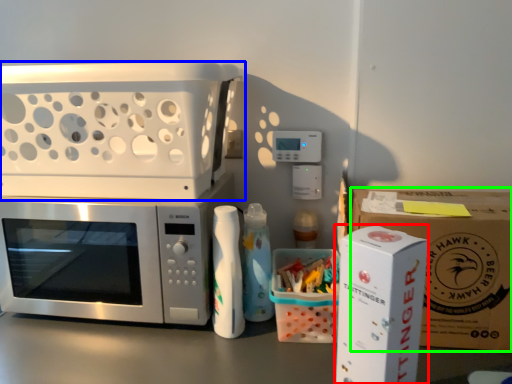
Question: Which object is the closest to the appliance (highlighted by a red box)? Choose among these: appliance (highlighted by a blue box) or cardboard box (highlighted by a green box).

Choices:
 (A) appliance
 (B) cardboard box

Answer: (B)